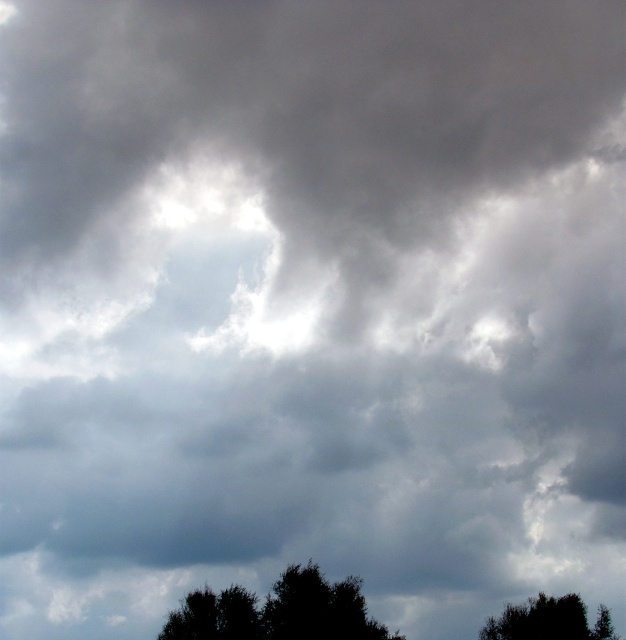
You are standing in a forest and see both the silhouette leafy tree at lower center and the green leafy tree at lower center in front of you. Which tree would block your view of the other?

The silhouette leafy tree at lower center is closer to the viewer than the green leafy tree at lower center, so it would block your view of the green leafy tree at lower center.

From the picture: You are standing in a forest and looking up at the sky. You see the silhouette leafy tree at lower center and the green leafy tree at lower right. Which tree is closer to you?

The silhouette leafy tree at lower center is closer to you because it is in front of the green leafy tree at lower right.